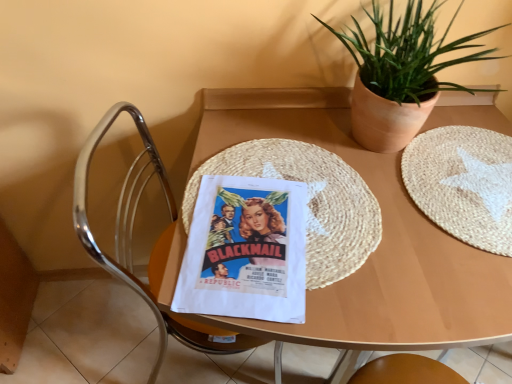
Question: From a real-world perspective, is white woven placemat at center right below polished chrome chair at left?

Choices:
 (A) yes
 (B) no

Answer: (B)

Question: Does white woven placemat at center right contain polished chrome chair at left?

Choices:
 (A) no
 (B) yes

Answer: (A)

Question: Can you confirm if white woven placemat at center right is taller than polished chrome chair at left?

Choices:
 (A) no
 (B) yes

Answer: (A)

Question: Is white woven placemat at center right aimed at polished chrome chair at left?

Choices:
 (A) yes
 (B) no

Answer: (B)

Question: Are white woven placemat at center right and polished chrome chair at left making contact?

Choices:
 (A) yes
 (B) no

Answer: (B)

Question: Is point (x=449, y=49) closer or farther from the camera than point (x=486, y=248)?

Choices:
 (A) closer
 (B) farther

Answer: (B)

Question: From the image's perspective, is green leafy plant in clay pot at upper right located above or below white woven placemat at center right?

Choices:
 (A) above
 (B) below

Answer: (A)

Question: Is green leafy plant in clay pot at upper right to the left or to the right of white woven placemat at center right in the image?

Choices:
 (A) right
 (B) left

Answer: (B)

Question: From a real-world perspective, relative to white woven placemat at center right, is green leafy plant in clay pot at upper right vertically above or below?

Choices:
 (A) above
 (B) below

Answer: (A)

Question: Is white woven placemat at center right bigger or smaller than polished chrome chair at left?

Choices:
 (A) small
 (B) big

Answer: (A)

Question: Which is correct: white woven placemat at center right is inside polished chrome chair at left, or outside of it?

Choices:
 (A) inside
 (B) outside

Answer: (B)

Question: Considering the positions of white woven placemat at center right and polished chrome chair at left in the image, is white woven placemat at center right wider or thinner than polished chrome chair at left?

Choices:
 (A) thin
 (B) wide

Answer: (B)

Question: Does point (424, 173) appear closer or farther from the camera than point (170, 213)?

Choices:
 (A) farther
 (B) closer

Answer: (B)

Question: From the image's perspective, is white woven placemat at center right above or below wooden placemat at center?

Choices:
 (A) above
 (B) below

Answer: (A)

Question: Is point (463, 155) positioned closer to the camera than point (338, 100)?

Choices:
 (A) closer
 (B) farther

Answer: (A)